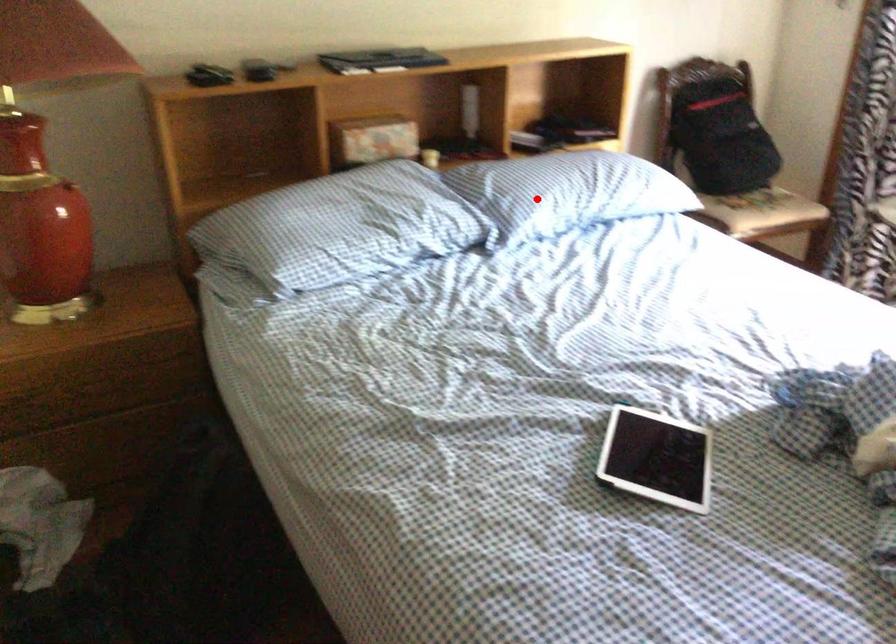
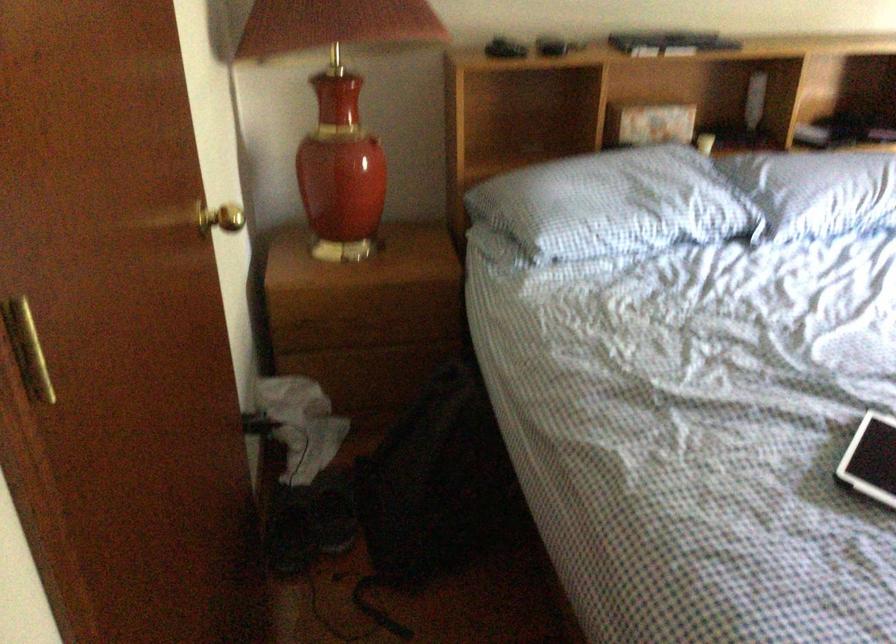
In the second image, find the point that corresponds to the highlighted location in the first image.

(817, 191)